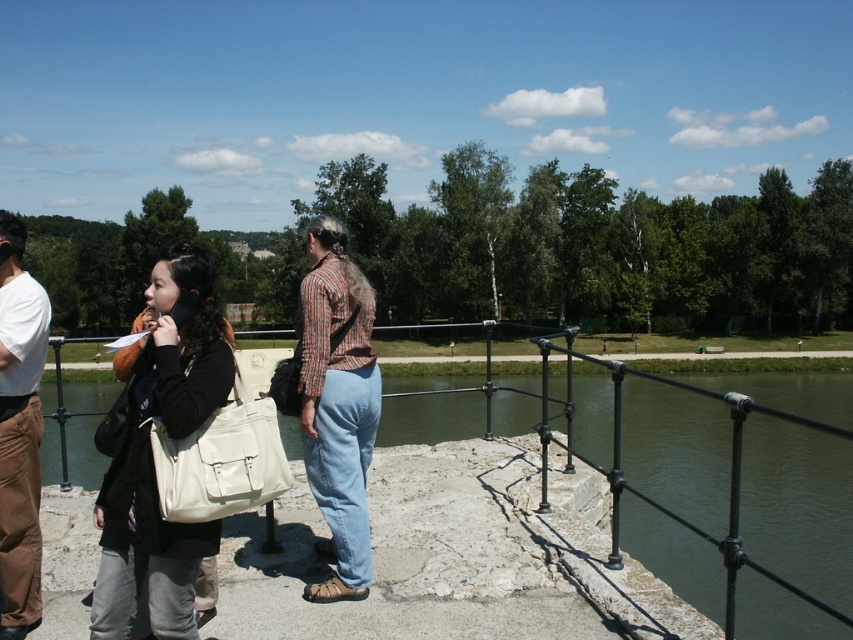
From the picture: Can you confirm if matte black jacket at left is positioned to the right of brown suede pants at left?

Yes, matte black jacket at left is to the right of brown suede pants at left.

Between point (115, 474) and point (27, 435), which one is positioned behind?

The point (27, 435) is more distant.

The height and width of the screenshot is (640, 853). What do you see at coordinates (152, 458) in the screenshot? I see `matte black jacket at left` at bounding box center [152, 458].

Identify the location of matte black jacket at left. Image resolution: width=853 pixels, height=640 pixels. (152, 458).

Is matte white bag at center to the right of brown suede pants at left from the viewer's perspective?

Indeed, matte white bag at center is positioned on the right side of brown suede pants at left.

Is matte white bag at center above brown suede pants at left?

Incorrect, matte white bag at center is not positioned above brown suede pants at left.

Which is behind, point (135, 388) or point (19, 589)?

The point (19, 589) is more distant.

Find the location of a particular element. matte white bag at center is located at coordinates (149, 452).

Identify the location of matte white bag at center. This screenshot has height=640, width=853. (149, 452).

Is matte white bag at center closer to camera compared to denim pants at center?

Yes, it is.

Image resolution: width=853 pixels, height=640 pixels. What do you see at coordinates (149, 452) in the screenshot? I see `matte white bag at center` at bounding box center [149, 452].

Locate an element on the screen. Image resolution: width=853 pixels, height=640 pixels. matte white bag at center is located at coordinates (149, 452).